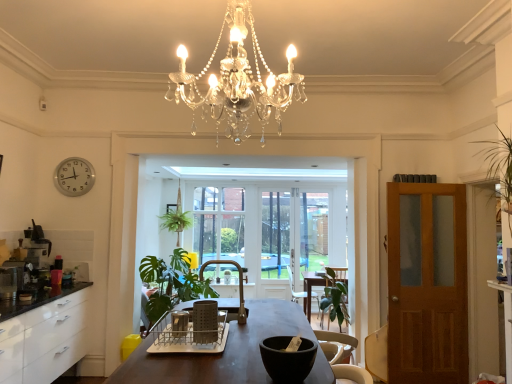
Question: Should I look upward or downward to see black matte bowl at center?

Choices:
 (A) down
 (B) up

Answer: (A)

Question: Would you say green fabric armchair at center, the 2th armchair viewed from the right, contains green leafy plant at center?

Choices:
 (A) no
 (B) yes

Answer: (A)

Question: From the image's perspective, does green fabric armchair at center, which ranks as the 1th armchair in left-to-right order, appear higher than green leafy plant at center?

Choices:
 (A) no
 (B) yes

Answer: (B)

Question: From a real-world perspective, is green fabric armchair at center, arranged as the second armchair when viewed from the back, physically below green leafy plant at center?

Choices:
 (A) no
 (B) yes

Answer: (A)

Question: Is green fabric armchair at center, the 1th armchair viewed from the front, positioned with its back to green leafy plant at center?

Choices:
 (A) yes
 (B) no

Answer: (B)

Question: Considering the relative sizes of green fabric armchair at center, arranged as the second armchair when viewed from the back, and green leafy plant at center in the image provided, is green fabric armchair at center, arranged as the second armchair when viewed from the back, taller than green leafy plant at center?

Choices:
 (A) yes
 (B) no

Answer: (B)

Question: Can you confirm if green fabric armchair at center, arranged as the second armchair when viewed from the back, is shorter than green leafy plant at center?

Choices:
 (A) yes
 (B) no

Answer: (A)

Question: From the image's perspective, would you say clear glass window screen at center, the 1th window screen from the right, is shown under wooden swivel chair at right?

Choices:
 (A) yes
 (B) no

Answer: (B)

Question: Can wooden swivel chair at right be found inside clear glass window screen at center, the 2th window screen viewed from the left?

Choices:
 (A) yes
 (B) no

Answer: (B)

Question: Is clear glass window screen at center, the 1th window screen from the right, at the right side of wooden swivel chair at right?

Choices:
 (A) yes
 (B) no

Answer: (B)

Question: Does clear glass window screen at center, the 1th window screen from the right, have a smaller size compared to wooden swivel chair at right?

Choices:
 (A) yes
 (B) no

Answer: (B)

Question: Is clear glass window screen at center, the 1th window screen from the right, not close to wooden swivel chair at right?

Choices:
 (A) no
 (B) yes

Answer: (B)

Question: Is clear glass window screen at center, the 1th window screen from the right, facing towards wooden swivel chair at right?

Choices:
 (A) yes
 (B) no

Answer: (A)

Question: Can you confirm if clear glass window screen at center, the 1th window screen from the right, is thinner than green fabric armchair at center, which is the second armchair from top to bottom?

Choices:
 (A) no
 (B) yes

Answer: (B)